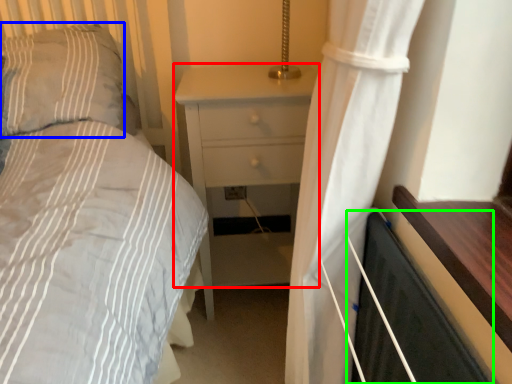
Question: Which object is the closest to the nightstand (highlighted by a red box)? Choose among these: pillow (highlighted by a blue box) or screen door (highlighted by a green box).

Choices:
 (A) pillow
 (B) screen door

Answer: (A)